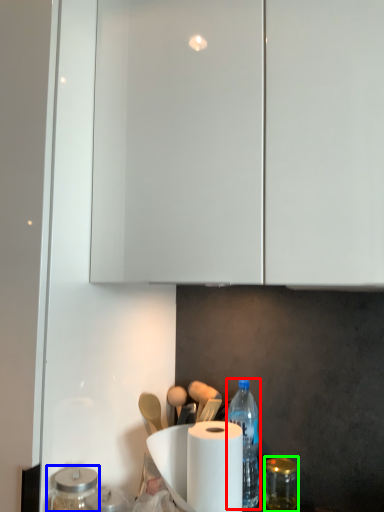
Question: Which object is positioned farthest from bottle (highlighted by a red box)? Select from glass jar (highlighted by a blue box) and glass jar (highlighted by a green box).

Choices:
 (A) glass jar
 (B) glass jar

Answer: (A)